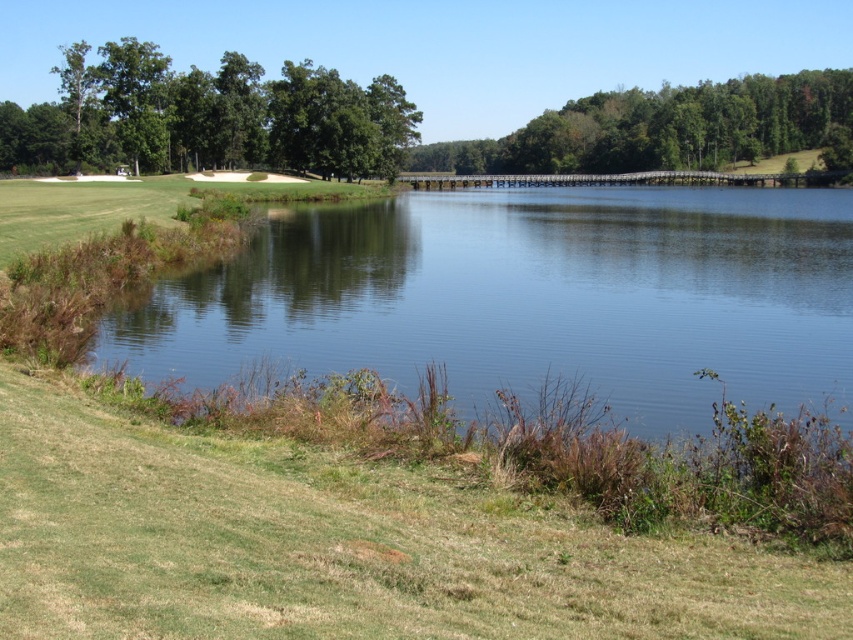
You are standing at the water edge and want to take a photo of the green leafy tree at upper left and the green leafy trees at upper right. Which tree group is positioned lower in the image?

The green leafy tree at upper left is positioned lower than the green leafy trees at upper right in the image.